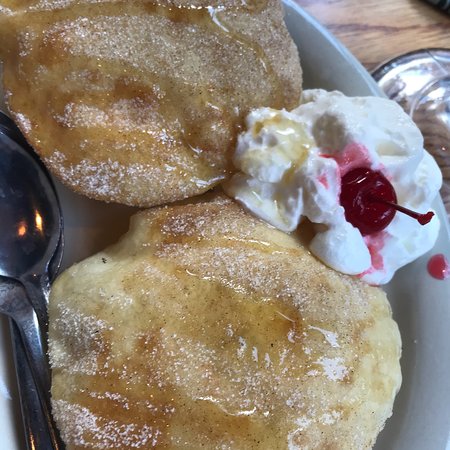
The height and width of the screenshot is (450, 450). Identify the location of spoon. (35, 221), (14, 293), (16, 138).